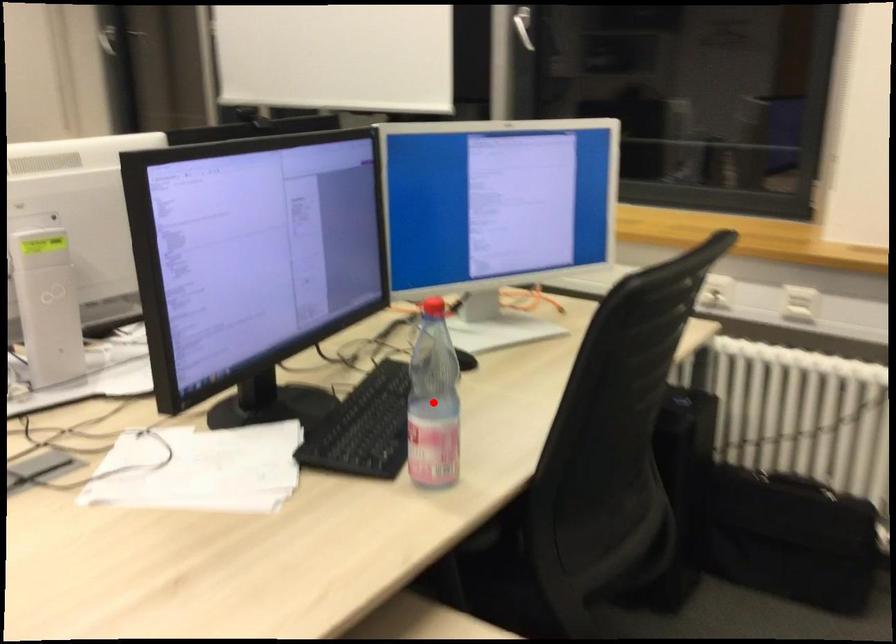
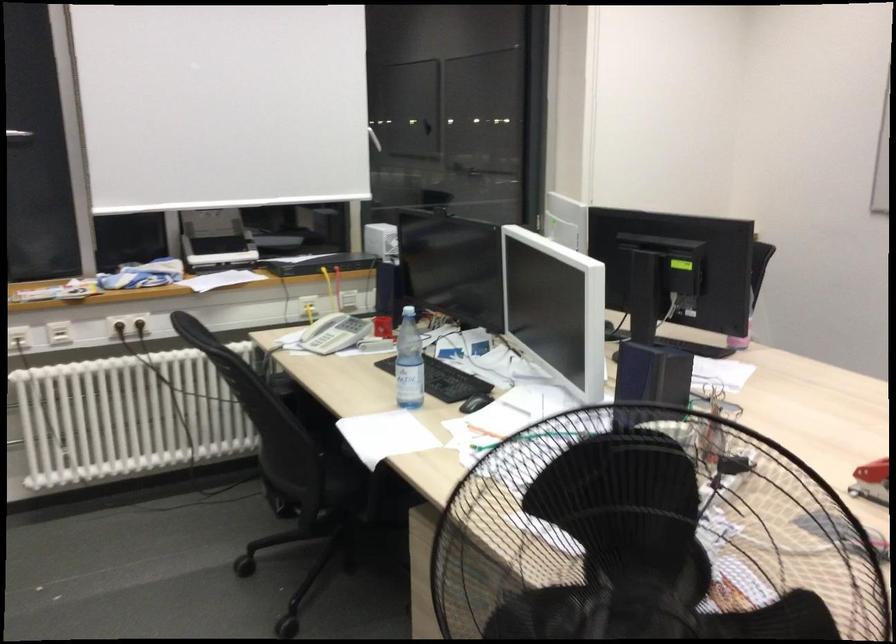
Question: I am providing you with two images of the same scene from different viewpoints. A red point is marked on the first image. At the location where the point appears in image 1, is it still visible in image 2?

Choices:
 (A) Yes
 (B) No

Answer: (B)